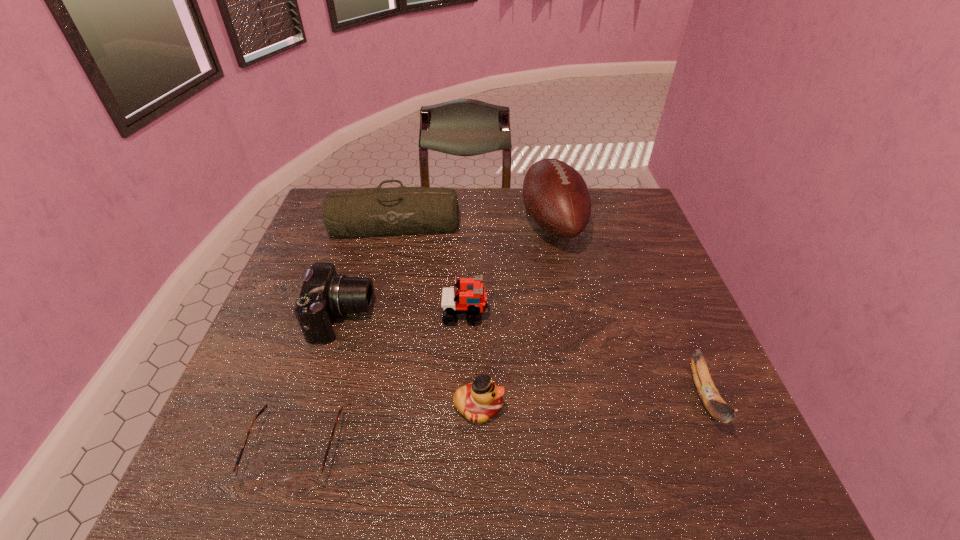
Where is `free area in between the Lego and the rightmost object`? free area in between the Lego and the rightmost object is located at coordinates click(x=586, y=355).

Where is `vacant point located between the duffel bag and the Lego`? The width and height of the screenshot is (960, 540). vacant point located between the duffel bag and the Lego is located at coordinates (430, 268).

This screenshot has height=540, width=960. What are the coordinates of `empty space between the banana and the spectacles` in the screenshot? It's located at (500, 423).

Find the location of a particular element. Image resolution: width=960 pixels, height=540 pixels. free space between the duffel bag and the shortest object is located at coordinates (346, 337).

Where is `free spot between the duck and the duffel bag`? The image size is (960, 540). free spot between the duck and the duffel bag is located at coordinates (437, 315).

At what (x,y) coordinates should I click in order to perform the action: click on vacant space in between the duffel bag and the banana. Please return your answer as a coordinate pair (x, y). Looking at the image, I should click on (550, 310).

Locate an element on the screen. vacant region between the camera and the rightmost object is located at coordinates (524, 357).

This screenshot has height=540, width=960. Find the location of `free space between the Lego and the shortest object`. free space between the Lego and the shortest object is located at coordinates tap(380, 381).

Image resolution: width=960 pixels, height=540 pixels. Identify the location of vacant point located between the football (American) and the shortest object. (424, 336).

Select which object is the sixth closest to the camera. Please provide its 2D coordinates. Your answer should be formatted as a tuple, i.e. [(x, y)], where the tuple contains the x and y coordinates of a point satisfying the conditions above.

[(717, 407)]